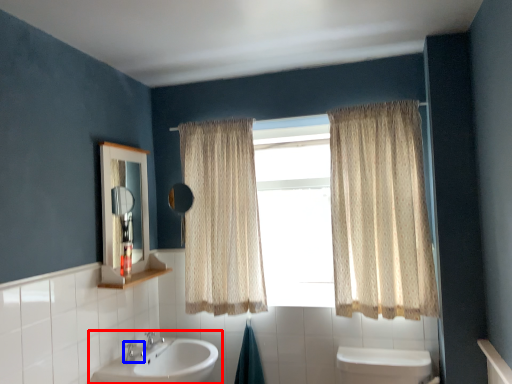
Question: Among these objects, which one is farthest to the camera, sink (highlighted by a red box) or plumbing fixture (highlighted by a blue box)?

Choices:
 (A) sink
 (B) plumbing fixture

Answer: (B)